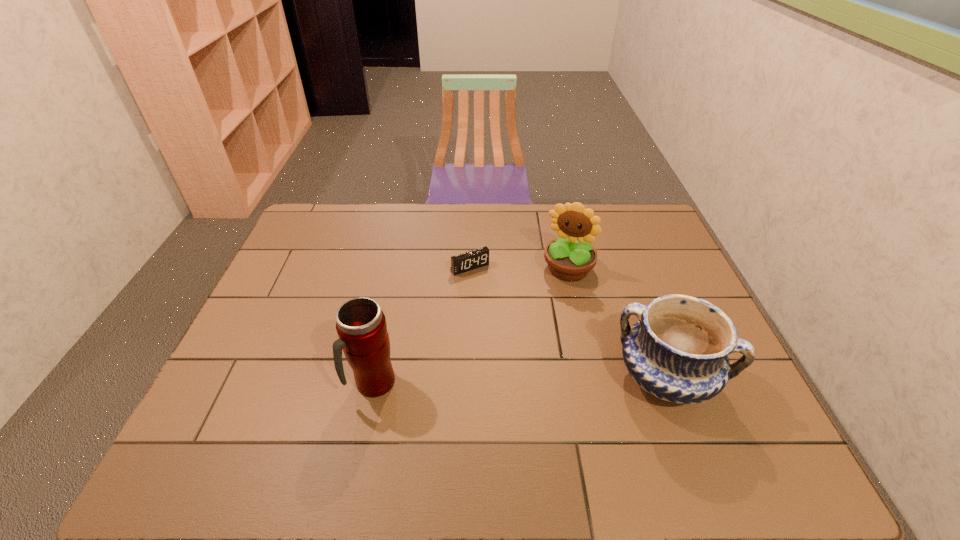
Locate an element on the screen. vacant space that's between the sunflower and the third tallest object is located at coordinates (617, 323).

Image resolution: width=960 pixels, height=540 pixels. In order to click on empty space between the second object from left to right and the thermos bottle in this screenshot , I will do `click(421, 326)`.

Locate an element on the screen. The height and width of the screenshot is (540, 960). free space between the third object from right to left and the pottery is located at coordinates (567, 323).

Where is `the second closest object to the leftmost object`? The height and width of the screenshot is (540, 960). the second closest object to the leftmost object is located at coordinates (570, 258).

Choose which object is the nearest neighbor to the second shortest object. Please provide its 2D coordinates. Your answer should be formatted as a tuple, i.e. [(x, y)], where the tuple contains the x and y coordinates of a point satisfying the conditions above.

[(570, 258)]